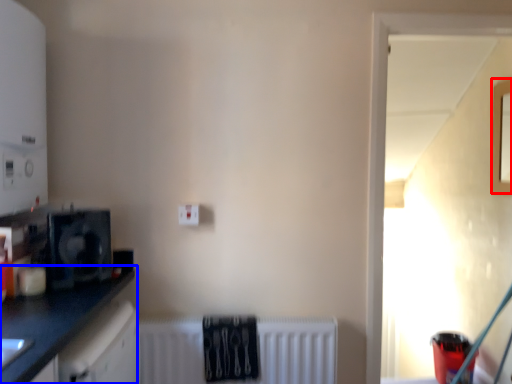
Question: Which object is closer to the camera taking this photo, window (highlighted by a red box) or countertop (highlighted by a blue box)?

Choices:
 (A) window
 (B) countertop

Answer: (B)